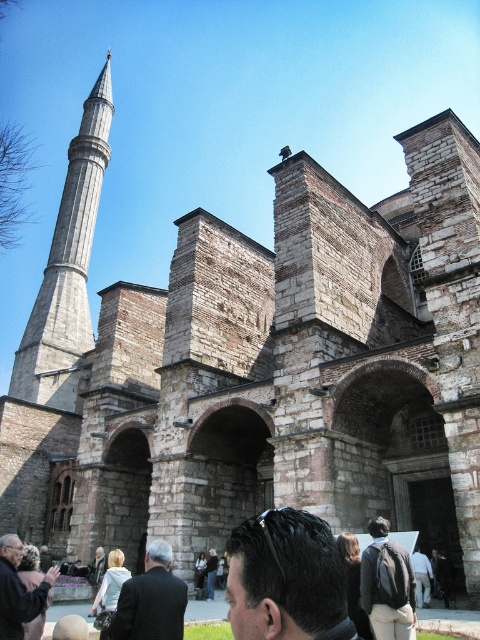
Is dark brown backpack at lower right to the left of dark brown leather jacket at lower left from the viewer's perspective?

Incorrect, dark brown backpack at lower right is not on the left side of dark brown leather jacket at lower left.

Which is below, dark brown backpack at lower right or dark brown leather jacket at lower left?

dark brown backpack at lower right is lower down.

Identify the location of dark brown backpack at lower right. (380, 588).

Does dark brown leather jacket at lower center have a larger size compared to dark brown backpack at lower right?

Yes, dark brown leather jacket at lower center is bigger than dark brown backpack at lower right.

Between point (149, 593) and point (369, 568), which one is positioned behind?

The point (369, 568) is behind.

Locate an element on the screen. The height and width of the screenshot is (640, 480). dark brown leather jacket at lower center is located at coordinates (151, 600).

Who is more distant from viewer, (244, 582) or (168, 554)?

The point (168, 554) is behind.

Who is higher up, dark brown hair at center or dark brown leather jacket at lower center?

dark brown hair at center

Does point (288, 611) come closer to viewer compared to point (170, 637)?

Yes.

The height and width of the screenshot is (640, 480). Find the location of `dark brown hair at center`. dark brown hair at center is located at coordinates (286, 579).